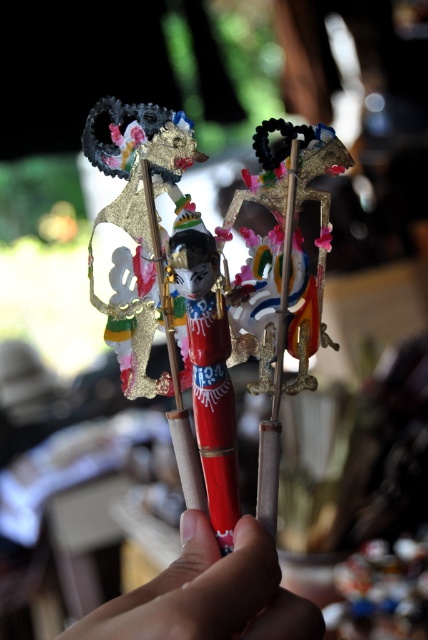
You are an artist trying to draw the scene with the smooth skin hand at center and the shiny red pen at center. Based on the description, which object should you draw first to ensure proper placement?

The shiny red pen at center should be drawn first since it is taller than the smooth skin hand at center, allowing you to position it appropriately before placing the hand beneath it.

You are an artist holding a shiny red pen at center and a smooth skin hand at center. You want to draw a detailed sketch of the shadow puppets. Which object has a larger width that might be more suitable for holding the pen comfortably?

The smooth skin hand at center has a larger width than the shiny red pen at center, so it would be more suitable for holding the pen comfortably.

You are an artist trying to draw the arrangement of the gold metallic puppet at center and the shiny red pen at center as seen in the image. Based on their positions, which object is located to the left of the other?

The shiny red pen at center is located to the left of the gold metallic puppet at center because the gold metallic puppet at center is positioned on the right side of the shiny red pen at center.